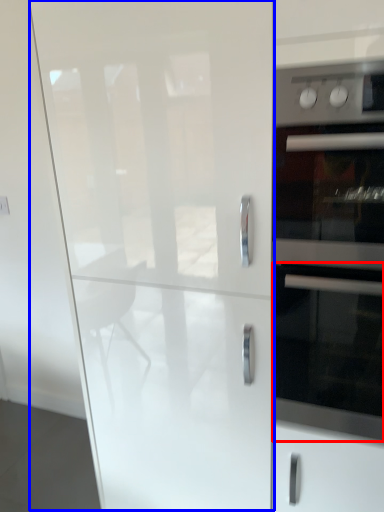
Question: Which object appears farthest to the camera in this image, oven (highlighted by a red box) or glass door (highlighted by a blue box)?

Choices:
 (A) oven
 (B) glass door

Answer: (A)